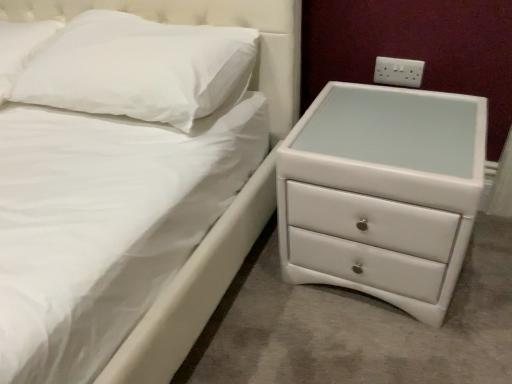
Question: Is white glossy chest of drawers at right looking in the opposite direction of white soft pillow at upper left, which is the first pillow in right-to-left order?

Choices:
 (A) yes
 (B) no

Answer: (B)

Question: Is white glossy chest of drawers at right to the left of white soft pillow at upper left, which is the first pillow in right-to-left order, from the viewer's perspective?

Choices:
 (A) yes
 (B) no

Answer: (B)

Question: Would you say white glossy chest of drawers at right is a long distance from white soft pillow at upper left, which is the first pillow in right-to-left order?

Choices:
 (A) no
 (B) yes

Answer: (A)

Question: From the image's perspective, is white glossy chest of drawers at right under white soft pillow at upper left, marked as the second pillow in a left-to-right arrangement?

Choices:
 (A) no
 (B) yes

Answer: (B)

Question: Is white glossy chest of drawers at right positioned beyond the bounds of white soft pillow at upper left, which is the first pillow in right-to-left order?

Choices:
 (A) yes
 (B) no

Answer: (A)

Question: Is white soft pillow at upper left, which is the first pillow in right-to-left order, a part of white glossy chest of drawers at right?

Choices:
 (A) yes
 (B) no

Answer: (B)

Question: Is white matte pillow at upper left, arranged as the 2th pillow when viewed from the right, facing towards white plastic electrical outlet at upper right?

Choices:
 (A) no
 (B) yes

Answer: (A)

Question: Is white matte pillow at upper left, which is counted as the 1th pillow, starting from the left, further to camera compared to white plastic electrical outlet at upper right?

Choices:
 (A) yes
 (B) no

Answer: (B)

Question: Is the depth of white matte pillow at upper left, arranged as the 2th pillow when viewed from the right, less than that of white plastic electrical outlet at upper right?

Choices:
 (A) yes
 (B) no

Answer: (A)

Question: Is white matte pillow at upper left, arranged as the 2th pillow when viewed from the right, turned away from white plastic electrical outlet at upper right?

Choices:
 (A) yes
 (B) no

Answer: (B)

Question: From a real-world perspective, is white matte pillow at upper left, arranged as the 2th pillow when viewed from the right, physically above white plastic electrical outlet at upper right?

Choices:
 (A) yes
 (B) no

Answer: (A)

Question: From a real-world perspective, is white matte pillow at upper left, arranged as the 2th pillow when viewed from the right, positioned under white plastic electrical outlet at upper right based on gravity?

Choices:
 (A) yes
 (B) no

Answer: (B)

Question: Is white matte pillow at upper left, which is counted as the 1th pillow, starting from the left, aimed at white glossy chest of drawers at right?

Choices:
 (A) no
 (B) yes

Answer: (A)